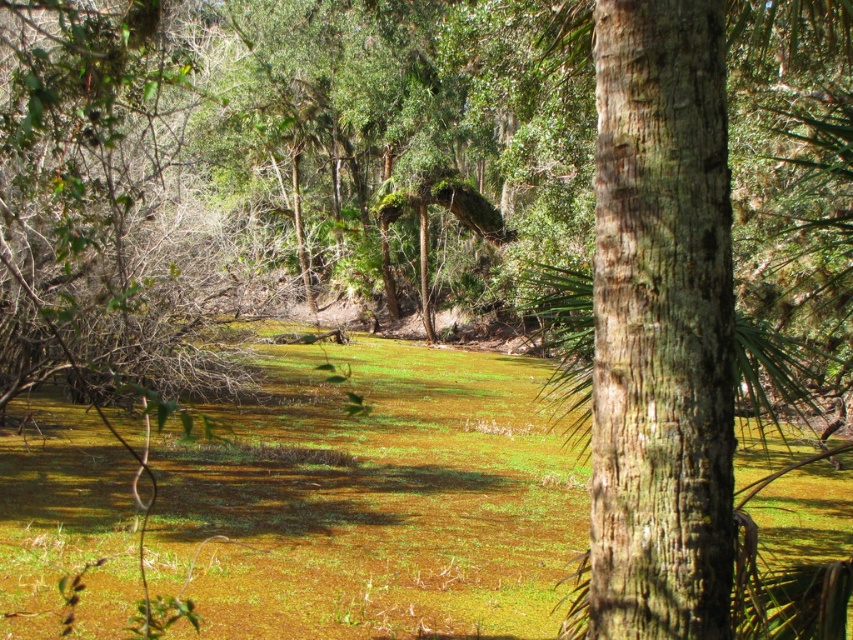
Is point (393, 364) behind point (656, 104)?

That is True.

Is green mossy at center to the left of brown rough bark tree at center from the viewer's perspective?

Yes, green mossy at center is to the left of brown rough bark tree at center.

Describe the element at coordinates (373, 500) in the screenshot. I see `green mossy at center` at that location.

Where is `green mossy at center`? The height and width of the screenshot is (640, 853). green mossy at center is located at coordinates (373, 500).